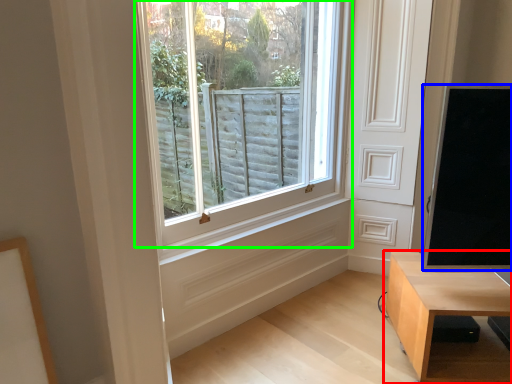
Question: Which is nearer to the table (highlighted by a red box)? window screen (highlighted by a blue box) or window (highlighted by a green box).

Choices:
 (A) window screen
 (B) window

Answer: (A)